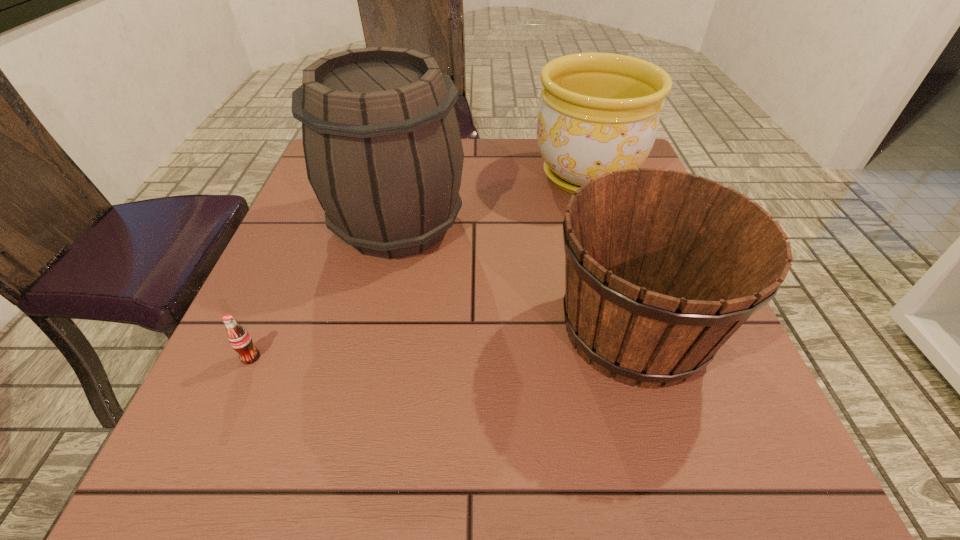
Where is `the tallest object`? This screenshot has height=540, width=960. the tallest object is located at coordinates (383, 151).

The image size is (960, 540). Find the location of `the second object from left to right`. the second object from left to right is located at coordinates (383, 151).

Identify the location of flowerpot. The height and width of the screenshot is (540, 960). (600, 112).

I want to click on the right wine bucket, so click(x=662, y=267).

You are a GUI agent. You are given a task and a screenshot of the screen. Output one action in this format:
    pyautogui.click(x=<x>, y=<y>)
    Task: Click on the shortest object
    The image size is (960, 540).
    Given the screenshot: What is the action you would take?
    pyautogui.click(x=240, y=340)

Where is `the leftmost object`? The image size is (960, 540). the leftmost object is located at coordinates (240, 340).

This screenshot has width=960, height=540. I want to click on blank space located on the right of the tallest object, so click(x=619, y=224).

Where is `vacant space situated 0.380m on the front of the flowerpot`? This screenshot has width=960, height=540. vacant space situated 0.380m on the front of the flowerpot is located at coordinates (636, 336).

Identify the location of vacant space located on the left of the shorter wine bucket. The width and height of the screenshot is (960, 540). (365, 329).

This screenshot has width=960, height=540. I want to click on free space located on the right of the soda, so click(372, 357).